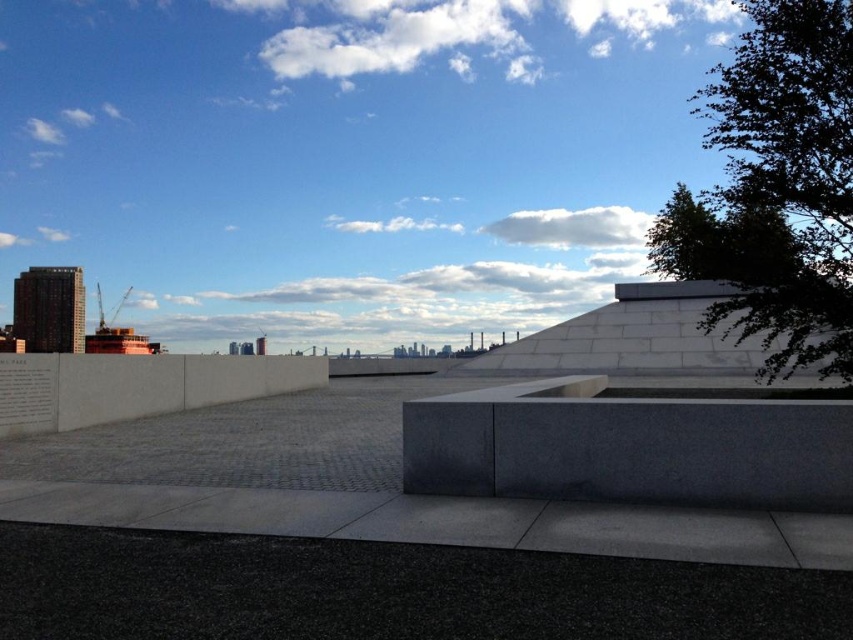
Can you confirm if gray granite ledge at center is positioned below white concrete ledge at center?

No.

Which of these two, gray granite ledge at center or white concrete ledge at center, stands shorter?

Standing shorter between the two is gray granite ledge at center.

Who is more distant from viewer, (746, 486) or (41, 388)?

Point (41, 388)

You are a GUI agent. You are given a task and a screenshot of the screen. Output one action in this format:
    pyautogui.click(x=<x>, y=<y>)
    Task: Click on the gray granite ledge at center
    Image resolution: width=853 pixels, height=640 pixels.
    Given the screenshot: What is the action you would take?
    pyautogui.click(x=630, y=448)

Measure the distance between green leafy tree at upper right and gray granite ledge at center.

99.55 feet

Locate an element on the screen. Image resolution: width=853 pixels, height=640 pixels. green leafy tree at upper right is located at coordinates (776, 188).

The height and width of the screenshot is (640, 853). Find the location of `green leafy tree at upper right`. green leafy tree at upper right is located at coordinates (776, 188).

Does point (840, 134) come closer to viewer compared to point (231, 358)?

Yes, point (840, 134) is closer to viewer.

Find the location of `green leafy tree at upper right`. green leafy tree at upper right is located at coordinates (776, 188).